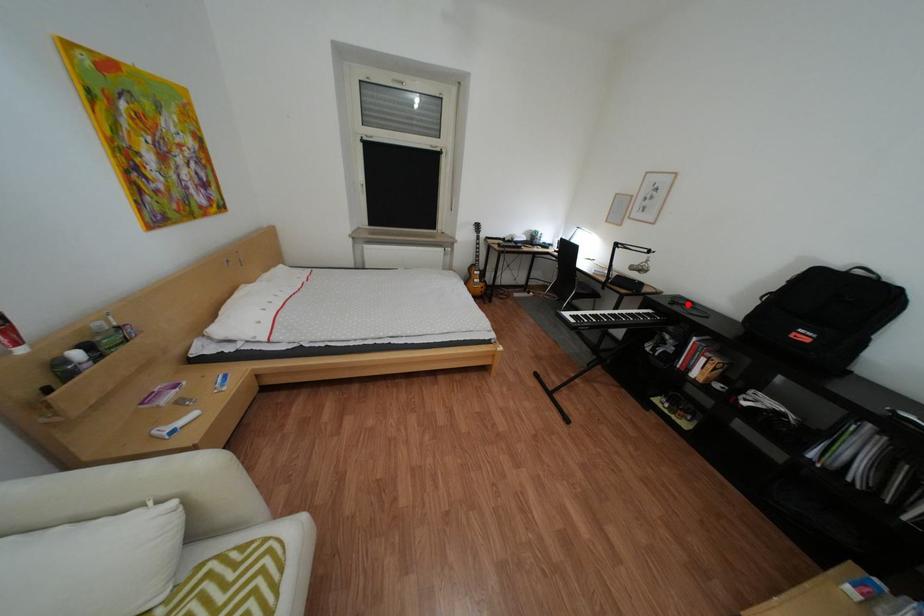
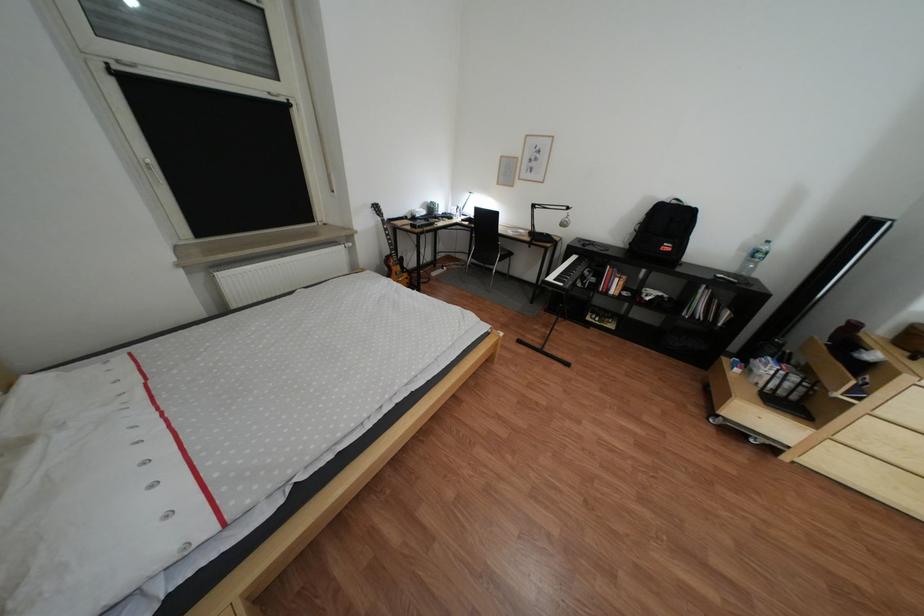
In the second image, find the point that corresponds to the highlighted location in the first image.

(600, 246)